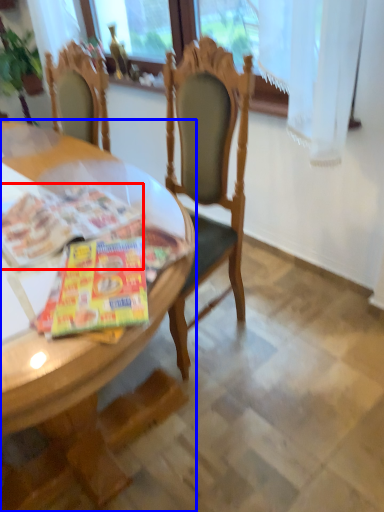
Question: Which object is closer to the camera taking this photo, magazine (highlighted by a red box) or desk (highlighted by a blue box)?

Choices:
 (A) magazine
 (B) desk

Answer: (B)